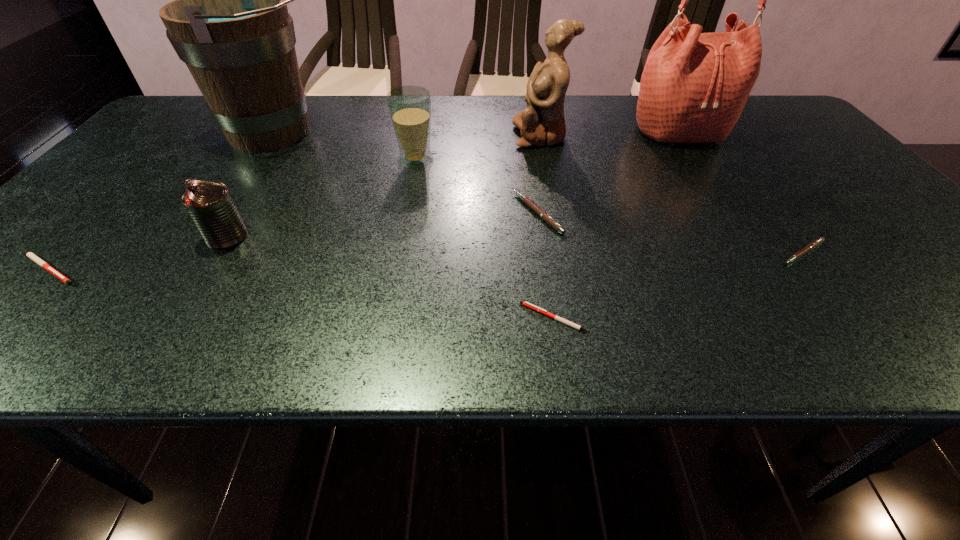
The width and height of the screenshot is (960, 540). Find the location of `vacant space that is in between the tallest object and the nearest pen`. vacant space that is in between the tallest object and the nearest pen is located at coordinates (617, 225).

Locate an element on the screen. Image resolution: width=960 pixels, height=540 pixels. vacant region between the nearer pink pen and the tallest pen is located at coordinates (670, 233).

Where is `free space between the handbag and the can`? The height and width of the screenshot is (540, 960). free space between the handbag and the can is located at coordinates (454, 185).

Where is `empty space that is in between the right white pen and the right pink pen`? The height and width of the screenshot is (540, 960). empty space that is in between the right white pen and the right pink pen is located at coordinates (679, 285).

Where is `object identified as the third closest to the handbag`? object identified as the third closest to the handbag is located at coordinates (815, 243).

Identify the location of object that is the closest one to the leftmost object. The width and height of the screenshot is (960, 540). (210, 205).

Identify which pen is located as the third nearest to the tallest object. Please provide its 2D coordinates. Your answer should be formatted as a tuple, i.e. [(x, y)], where the tuple contains the x and y coordinates of a point satisfying the conditions above.

[(529, 305)]

Where is `pen that is the second closest to the fourth shortest object`? The width and height of the screenshot is (960, 540). pen that is the second closest to the fourth shortest object is located at coordinates (815, 243).

Locate an element on the screen. free point that satisfies the following two spatial constraints: 1. at the nib of the nearer pink pen; 2. on the clicker of the shortest pen is located at coordinates (852, 318).

Identify the location of free location that satisfies the following two spatial constraints: 1. with a handle on the side of the fifth shortest object; 2. on the right side of the eighth shortest object. This screenshot has width=960, height=540. (208, 237).